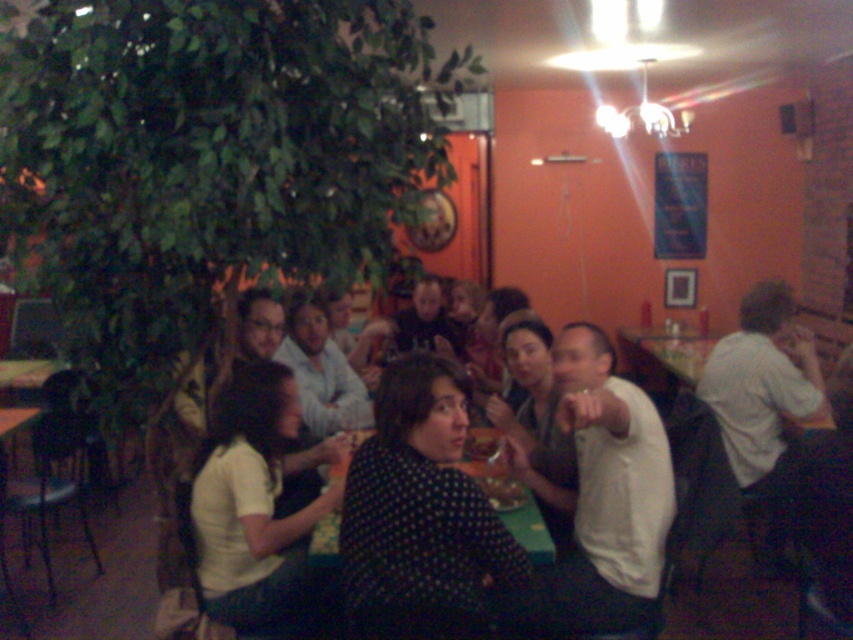
Does white matte shirt at center appear on the right side of green fabric table at center?

Indeed, white matte shirt at center is positioned on the right side of green fabric table at center.

Does white matte shirt at center have a larger size compared to green fabric table at center?

Yes, white matte shirt at center is bigger than green fabric table at center.

Does point (572, 490) come behind point (548, 557)?

Yes.

Image resolution: width=853 pixels, height=640 pixels. I want to click on white matte shirt at center, so coord(601,497).

Is polka dot shirt at center below green fabric table at center?

Incorrect, polka dot shirt at center is not positioned below green fabric table at center.

Is polka dot shirt at center to the left of green fabric table at center from the viewer's perspective?

Correct, you'll find polka dot shirt at center to the left of green fabric table at center.

I want to click on polka dot shirt at center, so click(x=421, y=512).

Who is more forward, [300,520] or [498,465]?

Positioned in front is point [300,520].

Who is more forward, (248, 419) or (328, 536)?

Point (328, 536) is more forward.

Where is `white matte shirt at lower left`? The width and height of the screenshot is (853, 640). white matte shirt at lower left is located at coordinates (253, 504).